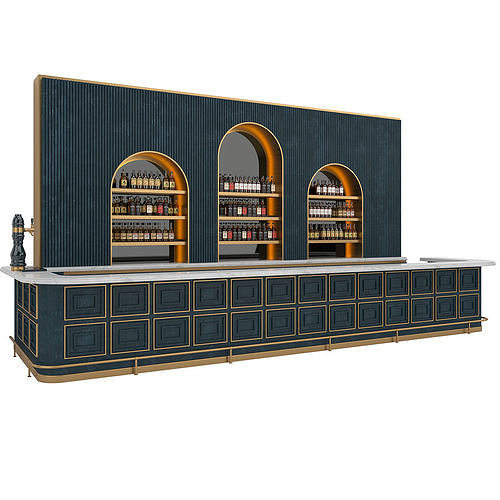
Locate an element on the screen. Image resolution: width=500 pixels, height=500 pixels. ornate beer tap, left side center is located at coordinates (16, 235).